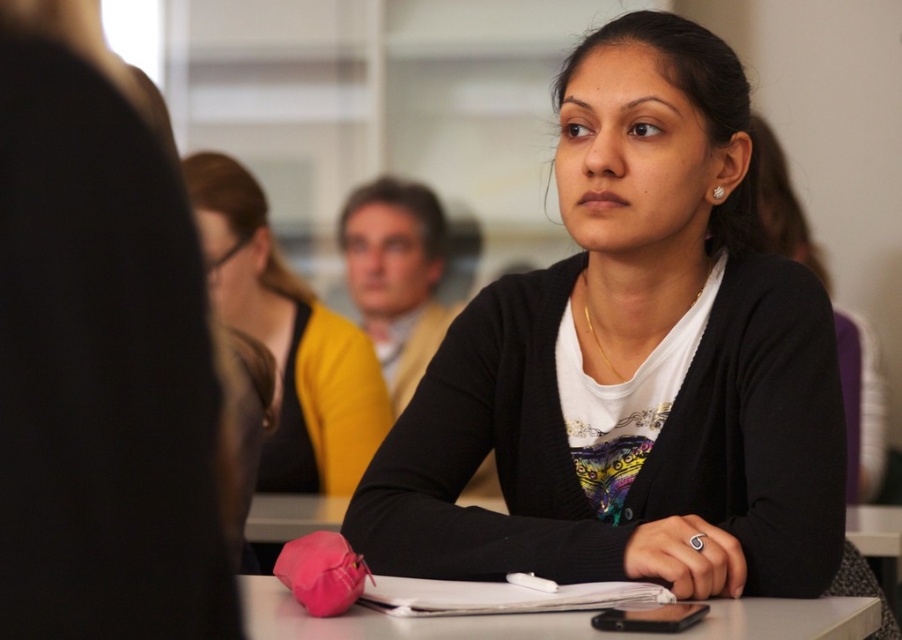
Question: Which point appears farthest from the camera in this image?

Choices:
 (A) (633, 438)
 (B) (576, 627)
 (C) (373, 388)

Answer: (C)

Question: Does matte yellow sweater at center appear under white paper at center?

Choices:
 (A) no
 (B) yes

Answer: (A)

Question: Does black matte cardigan at center have a larger size compared to matte yellow sweater at center?

Choices:
 (A) no
 (B) yes

Answer: (B)

Question: Can you confirm if black matte cardigan at center is smaller than matte yellow sweater at center?

Choices:
 (A) no
 (B) yes

Answer: (A)

Question: Considering the real-world distances, which object is farthest from the matte yellow sweater at center?

Choices:
 (A) white paper at center
 (B) black matte cardigan at center

Answer: (A)

Question: Which point is closer to the camera taking this photo?

Choices:
 (A) (643, 435)
 (B) (354, 618)

Answer: (B)